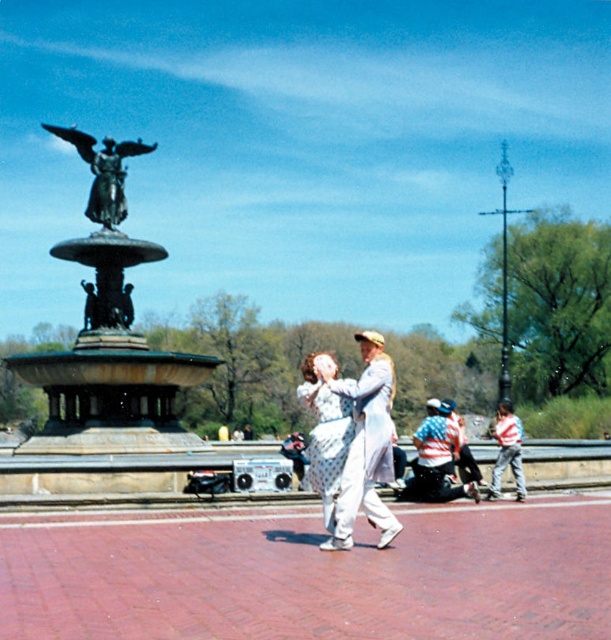
Which is more to the left, bronze statue at center or bronze statue at upper left?

From the viewer's perspective, bronze statue at upper left appears more on the left side.

Does bronze statue at center have a greater width compared to bronze statue at upper left?

Correct, the width of bronze statue at center exceeds that of bronze statue at upper left.

Between point (104, 262) and point (139, 141), which one is positioned behind?

The point (139, 141) is behind.

Locate an element on the screen. Image resolution: width=611 pixels, height=640 pixels. bronze statue at center is located at coordinates (108, 333).

Which is more to the right, striped shirt at center or striped shirt at lower right?

striped shirt at lower right

Which is above, striped shirt at center or striped shirt at lower right?

striped shirt at lower right

Does point (441, 412) come in front of point (499, 429)?

Yes.

At what (x,y) coordinates should I click in order to perform the action: click on striped shirt at center. Please return your answer as a coordinate pair (x, y). The image size is (611, 640). Looking at the image, I should click on (441, 456).

Does white dotted dress at center appear under bronze statue at upper left?

Yes, white dotted dress at center is below bronze statue at upper left.

Which of these two, white dotted dress at center or bronze statue at upper left, stands shorter?

With less height is white dotted dress at center.

Is point (389, 385) farther from viewer compared to point (117, 172)?

That is False.

The width and height of the screenshot is (611, 640). Find the location of `white dotted dress at center`. white dotted dress at center is located at coordinates (367, 445).